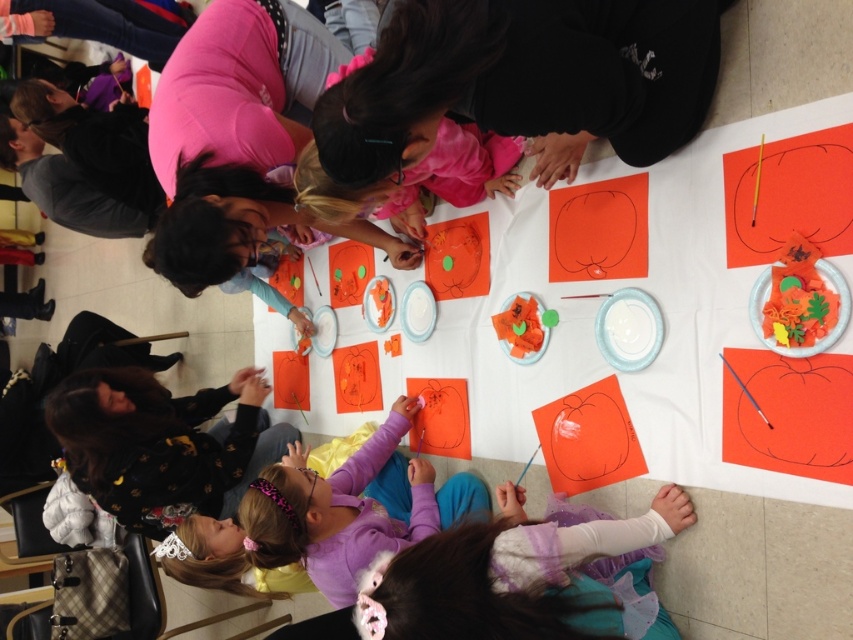
Who is shorter, orange paper plate at upper right or white paper plate at center?

white paper plate at center

Which is behind, point (807, 349) or point (427, 330)?

The point (427, 330) is behind.

Between point (827, 262) and point (415, 298), which one is positioned in front?

Positioned in front is point (827, 262).

Find the location of `orange paper plate at upper right`. orange paper plate at upper right is located at coordinates (813, 340).

From the picture: Which is above, white glossy paper plate at center or white paper plate at center?

white paper plate at center is above.

Which is behind, point (619, 346) or point (415, 317)?

The point (415, 317) is behind.

Locate an element on the screen. The height and width of the screenshot is (640, 853). white glossy paper plate at center is located at coordinates (628, 328).

In the scene shown: Is purple fleece sweater at lower center positioned before white glossy paper plate at center?

That is False.

Between point (96, 449) and point (618, 360), which one is positioned in front?

Point (618, 360)

The width and height of the screenshot is (853, 640). Describe the element at coordinates (161, 444) in the screenshot. I see `purple fleece sweater at lower center` at that location.

You are a GUI agent. You are given a task and a screenshot of the screen. Output one action in this format:
    pyautogui.click(x=<x>, y=<y>)
    Task: Click on the purple fleece sweater at lower center
    This screenshot has width=853, height=640.
    Given the screenshot: What is the action you would take?
    pyautogui.click(x=161, y=444)